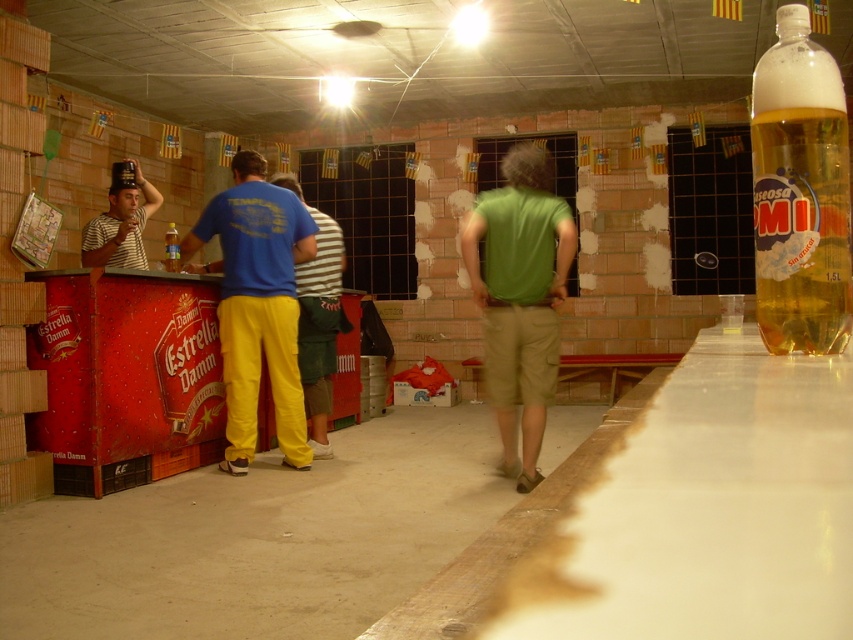
Question: Does yellow cotton pants at center lie in front of translucent yellow bottle at center?

Choices:
 (A) no
 (B) yes

Answer: (B)

Question: Can you confirm if green matte shirt at center is positioned above yellow cotton pants at center?

Choices:
 (A) yes
 (B) no

Answer: (A)

Question: Which object is the closest to the blue cotton shirt at left?

Choices:
 (A) green matte shirt at center
 (B) yellow cotton pants at center
 (C) striped fabric hat at left
 (D) translucent yellow bottle at center

Answer: (B)

Question: Which object is closer to the camera taking this photo?

Choices:
 (A) yellow cotton pants at center
 (B) translucent yellow bottle at center
 (C) striped fabric hat at left
 (D) green matte shirt at center

Answer: (D)

Question: Estimate the real-world distances between objects in this image. Which object is closer to the blue cotton shirt at left?

Choices:
 (A) translucent plastic bottle of beer at upper right
 (B) translucent yellow bottle at center
 (C) green matte shirt at center

Answer: (B)

Question: Is yellow cotton pants at center wider than translucent yellow bottle at center?

Choices:
 (A) yes
 (B) no

Answer: (A)